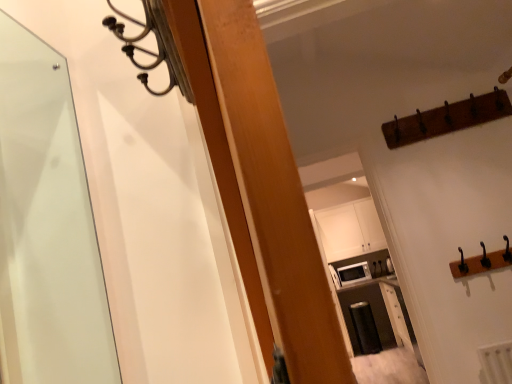
This screenshot has height=384, width=512. What do you see at coordinates (353, 273) in the screenshot? I see `white glossy microwave at upper center` at bounding box center [353, 273].

Where is `white glossy microwave at upper center`? white glossy microwave at upper center is located at coordinates tap(353, 273).

The height and width of the screenshot is (384, 512). What do you see at coordinates (350, 229) in the screenshot?
I see `white matte cabinet at upper center` at bounding box center [350, 229].

What is the approximate width of white matte cabinet at upper center?

white matte cabinet at upper center is 14.79 inches wide.

Find the location of `white matte cabinet at upper center`. white matte cabinet at upper center is located at coordinates (350, 229).

Where is `white glossy microwave at upper center`? Image resolution: width=512 pixels, height=384 pixels. white glossy microwave at upper center is located at coordinates (353, 273).

Can you confirm if white matte cabinet at upper center is positioned to the left of white glossy microwave at upper center?

Yes.

Is white matte cabinet at upper center closer to the viewer compared to white glossy microwave at upper center?

No.

Which is nearer, (x=335, y=245) or (x=362, y=270)?

The point (x=362, y=270) is more forward.

From the image's perspective, is white matte cabinet at upper center on white glossy microwave at upper center?

Indeed, from the image's perspective, white matte cabinet at upper center is shown above white glossy microwave at upper center.

From a real-world perspective, which object rests below the other?

From a 3D spatial view, white glossy microwave at upper center is below.

Does white matte cabinet at upper center have a greater width compared to white glossy microwave at upper center?

No.

Based on the photo, who is taller, white matte cabinet at upper center or white glossy microwave at upper center?

Standing taller between the two is white matte cabinet at upper center.

Can you confirm if white matte cabinet at upper center is bigger than white glossy microwave at upper center?

Indeed, white matte cabinet at upper center has a larger size compared to white glossy microwave at upper center.

Is white glossy microwave at upper center surrounded by white matte cabinet at upper center?

No, white matte cabinet at upper center does not contain white glossy microwave at upper center.

Is white matte cabinet at upper center next to white glossy microwave at upper center and touching it?

white matte cabinet at upper center and white glossy microwave at upper center are not in contact.

Is white matte cabinet at upper center oriented towards white glossy microwave at upper center?

No, white matte cabinet at upper center is not turned towards white glossy microwave at upper center.

What's the angular difference between white matte cabinet at upper center and white glossy microwave at upper center's facing directions?

0.0134 degrees separate the facing orientations of white matte cabinet at upper center and white glossy microwave at upper center.

Identify the location of appliance lying in front of the white matte cabinet at upper center. (353, 273).

Is white glossy microwave at upper center at the left side of white matte cabinet at upper center?

Incorrect, white glossy microwave at upper center is not on the left side of white matte cabinet at upper center.

Does white glossy microwave at upper center come behind white matte cabinet at upper center?

That is False.

Does point (341, 272) come behind point (354, 251)?

No, (341, 272) is closer to viewer.

From the image's perspective, which one is positioned lower, white glossy microwave at upper center or white matte cabinet at upper center?

white glossy microwave at upper center is shown below in the image.

Based on the photo, from a real-world perspective, which is physically below, white glossy microwave at upper center or white matte cabinet at upper center?

white glossy microwave at upper center is physically lower.

Considering the relative sizes of white glossy microwave at upper center and white matte cabinet at upper center in the image provided, is white glossy microwave at upper center wider than white matte cabinet at upper center?

Yes.

Considering the sizes of objects white glossy microwave at upper center and white matte cabinet at upper center in the image provided, who is shorter, white glossy microwave at upper center or white matte cabinet at upper center?

Standing shorter between the two is white glossy microwave at upper center.

Between white glossy microwave at upper center and white matte cabinet at upper center, which one has smaller size?

white glossy microwave at upper center.

Is white matte cabinet at upper center inside white glossy microwave at upper center?

That's incorrect, white matte cabinet at upper center is not inside white glossy microwave at upper center.

Is white glossy microwave at upper center next to white matte cabinet at upper center?

white glossy microwave at upper center and white matte cabinet at upper center are not in contact.

Does white glossy microwave at upper center turn towards white matte cabinet at upper center?

No, white glossy microwave at upper center is not oriented towards white matte cabinet at upper center.

How distant is white glossy microwave at upper center from white matte cabinet at upper center?

The distance of white glossy microwave at upper center from white matte cabinet at upper center is 17.62 inches.

Locate an element on the screen. This screenshot has width=512, height=384. cabinetry lying on the left of white glossy microwave at upper center is located at coordinates click(350, 229).

Image resolution: width=512 pixels, height=384 pixels. What are the coordinates of `appliance lying in front of the white matte cabinet at upper center` in the screenshot? It's located at (353, 273).

At what (x,y) coordinates should I click in order to perform the action: click on cabinetry above the white glossy microwave at upper center (from the image's perspective). Please return your answer as a coordinate pair (x, y). The height and width of the screenshot is (384, 512). Looking at the image, I should click on (350, 229).